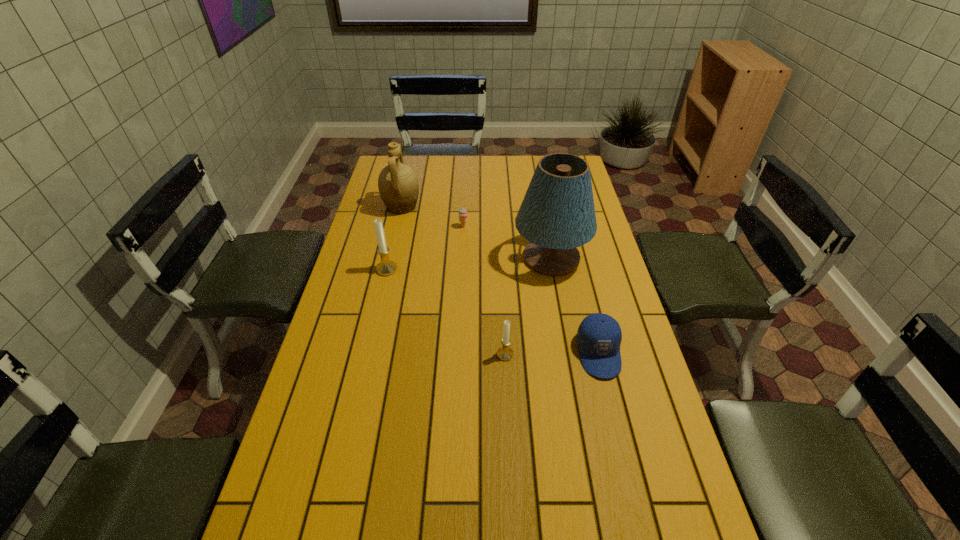
In order to click on blank region between the cap and the third tallest object in this screenshot , I will do `click(492, 311)`.

What are the coordinates of `free space between the pitcher and the third tallest object` in the screenshot? It's located at (395, 238).

Locate which object ranks second in proximity to the second farthest object. Please provide its 2D coordinates. Your answer should be formatted as a tuple, i.e. [(x, y)], where the tuple contains the x and y coordinates of a point satisfying the conditions above.

[(557, 214)]

Choose which object is the second nearest neighbor to the left candle holder. Please provide its 2D coordinates. Your answer should be formatted as a tuple, i.e. [(x, y)], where the tuple contains the x and y coordinates of a point satisfying the conditions above.

[(463, 214)]

The image size is (960, 540). I want to click on free space that satisfies the following two spatial constraints: 1. on the front side of the fifth nearest object; 2. on the left side of the farthest object, so click(x=397, y=226).